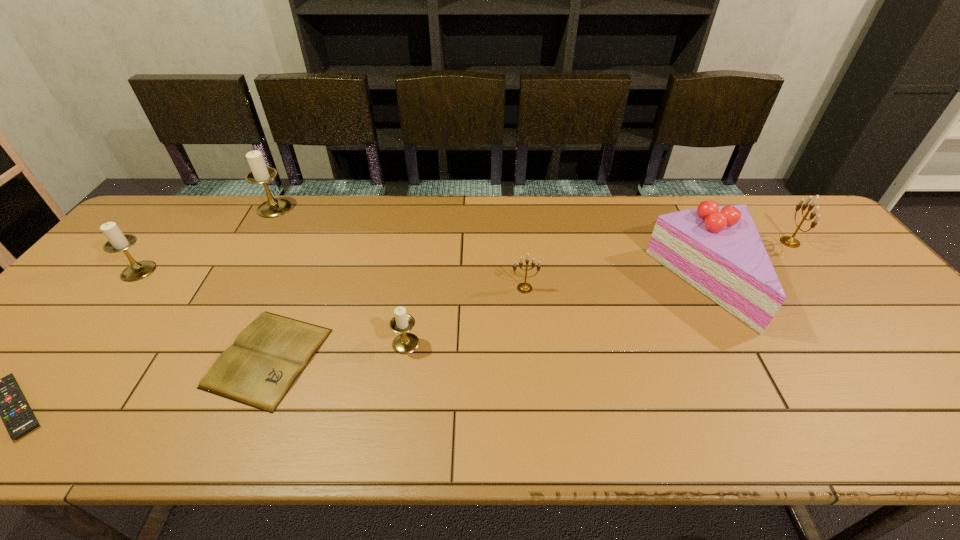
At what (x,y) coordinates should I click in order to perform the action: click on the second white candle holder from left to right. Please return your answer as a coordinate pair (x, y). The image size is (960, 540). Looking at the image, I should click on (260, 174).

At what (x,y) coordinates should I click in order to perform the action: click on the farthest white candle holder. Please return your answer as a coordinate pair (x, y). This screenshot has width=960, height=540. Looking at the image, I should click on (260, 174).

The image size is (960, 540). Find the location of `purple cake`. purple cake is located at coordinates (717, 249).

Where is `the seventh object from left to right`? The width and height of the screenshot is (960, 540). the seventh object from left to right is located at coordinates (717, 249).

The height and width of the screenshot is (540, 960). I want to click on the rightmost object, so click(x=789, y=241).

Where is `the fourth nearest candle holder`? the fourth nearest candle holder is located at coordinates (789, 241).

Locate an element on the screen. the second farthest white candle holder is located at coordinates (117, 241).

Find the location of `the third farthest candle holder`. the third farthest candle holder is located at coordinates (117, 241).

Image resolution: width=960 pixels, height=540 pixels. Identify the location of the left gold candelabrum. (524, 287).

Identify the location of the smaller gold candelabrum. This screenshot has width=960, height=540. click(x=524, y=287).